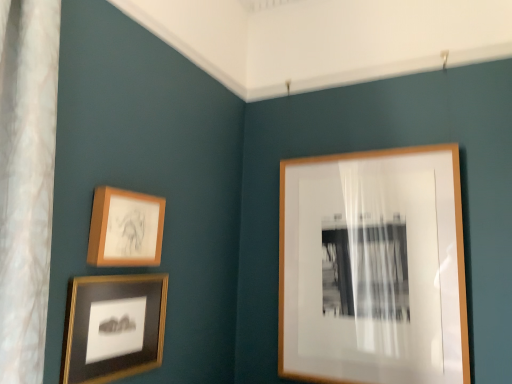
Question: Is matte black frame at lower left, arranged as the first picture frame when viewed from the left, smaller than matte wooden picture frame at upper left, which ranks as the second picture frame in left-to-right order?

Choices:
 (A) yes
 (B) no

Answer: (B)

Question: Is matte black frame at lower left, the 3th picture frame when ordered from right to left, wider than matte wooden picture frame at upper left, which ranks as the second picture frame in left-to-right order?

Choices:
 (A) yes
 (B) no

Answer: (B)

Question: Is the position of matte black frame at lower left, the 3th picture frame when ordered from right to left, more distant than that of matte wooden picture frame at upper left, which ranks as the second picture frame in left-to-right order?

Choices:
 (A) no
 (B) yes

Answer: (A)

Question: Considering the relative positions of matte black frame at lower left, arranged as the first picture frame when viewed from the left, and matte wooden picture frame at upper left, which ranks as the second picture frame in left-to-right order, in the image provided, is matte black frame at lower left, arranged as the first picture frame when viewed from the left, to the right of matte wooden picture frame at upper left, which ranks as the second picture frame in left-to-right order, from the viewer's perspective?

Choices:
 (A) yes
 (B) no

Answer: (B)

Question: Does matte black frame at lower left, the 3th picture frame when ordered from right to left, come in front of matte wooden picture frame at upper left, which appears as the second picture frame when viewed from the right?

Choices:
 (A) no
 (B) yes

Answer: (B)

Question: From the image's perspective, is matte wooden picture frame at upper left, which appears as the second picture frame when viewed from the right, positioned above or below wooden frame at upper right, which is the 1th picture frame from right to left?

Choices:
 (A) below
 (B) above

Answer: (B)

Question: Considering their positions, is matte wooden picture frame at upper left, which ranks as the second picture frame in left-to-right order, located in front of or behind wooden frame at upper right, the 3th picture frame positioned from the left?

Choices:
 (A) front
 (B) behind

Answer: (A)

Question: In terms of width, does matte wooden picture frame at upper left, which appears as the second picture frame when viewed from the right, look wider or thinner when compared to wooden frame at upper right, the 3th picture frame positioned from the left?

Choices:
 (A) wide
 (B) thin

Answer: (B)

Question: Is point (128, 238) positioned closer to the camera than point (337, 347)?

Choices:
 (A) farther
 (B) closer

Answer: (B)

Question: Considering the positions of matte wooden picture frame at upper left, which appears as the second picture frame when viewed from the right, and matte black frame at lower left, arranged as the first picture frame when viewed from the left, in the image, is matte wooden picture frame at upper left, which appears as the second picture frame when viewed from the right, wider or thinner than matte black frame at lower left, arranged as the first picture frame when viewed from the left,?

Choices:
 (A) thin
 (B) wide

Answer: (B)

Question: Choose the correct answer: Is matte wooden picture frame at upper left, which appears as the second picture frame when viewed from the right, inside matte black frame at lower left, the 3th picture frame when ordered from right to left, or outside it?

Choices:
 (A) outside
 (B) inside

Answer: (A)

Question: Relative to matte black frame at lower left, the 3th picture frame when ordered from right to left, is matte wooden picture frame at upper left, which ranks as the second picture frame in left-to-right order, in front or behind?

Choices:
 (A) behind
 (B) front

Answer: (A)

Question: Does point pyautogui.click(x=142, y=256) appear closer or farther from the camera than point pyautogui.click(x=91, y=301)?

Choices:
 (A) farther
 (B) closer

Answer: (A)

Question: Based on their sizes in the image, would you say wooden frame at upper right, the 3th picture frame positioned from the left, is bigger or smaller than matte black frame at lower left, the 3th picture frame when ordered from right to left?

Choices:
 (A) big
 (B) small

Answer: (A)

Question: From a real-world perspective, is wooden frame at upper right, the 3th picture frame positioned from the left, above or below matte black frame at lower left, the 3th picture frame when ordered from right to left?

Choices:
 (A) above
 (B) below

Answer: (A)